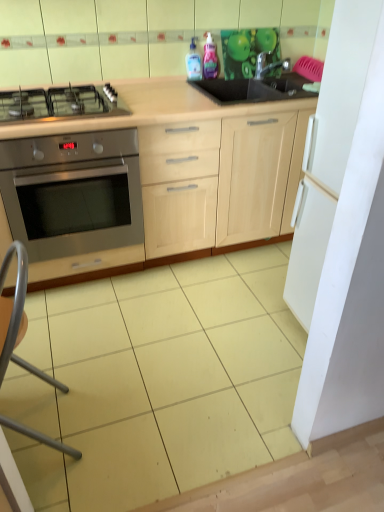
This screenshot has height=512, width=384. Identify the location of vacant space that's between pink glossy bottle at upper center, the first bottle when ordered from right to left, and metallic faucet at upper right. (240, 79).